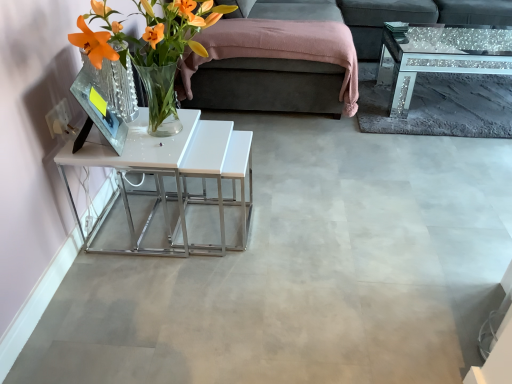
Question: Considering the relative sizes of dark gray fabric studio couch at upper center and dark gray fabric couch at upper right in the image provided, is dark gray fabric studio couch at upper center shorter than dark gray fabric couch at upper right?

Choices:
 (A) no
 (B) yes

Answer: (A)

Question: From a real-world perspective, is dark gray fabric studio couch at upper center on dark gray fabric couch at upper right?

Choices:
 (A) yes
 (B) no

Answer: (A)

Question: Is dark gray fabric studio couch at upper center closer to the viewer compared to dark gray fabric couch at upper right?

Choices:
 (A) no
 (B) yes

Answer: (B)

Question: Does dark gray fabric studio couch at upper center turn towards dark gray fabric couch at upper right?

Choices:
 (A) yes
 (B) no

Answer: (B)

Question: Is dark gray fabric studio couch at upper center not near dark gray fabric couch at upper right?

Choices:
 (A) no
 (B) yes

Answer: (A)

Question: Does dark gray fabric studio couch at upper center contain dark gray fabric couch at upper right?

Choices:
 (A) yes
 (B) no

Answer: (A)

Question: Is there a large distance between dark gray fabric couch at upper right and translucent glass vase at left?

Choices:
 (A) yes
 (B) no

Answer: (A)

Question: Is dark gray fabric couch at upper right smaller than translucent glass vase at left?

Choices:
 (A) yes
 (B) no

Answer: (B)

Question: Is dark gray fabric couch at upper right not inside translucent glass vase at left?

Choices:
 (A) no
 (B) yes

Answer: (B)

Question: Is dark gray fabric couch at upper right at the left side of translucent glass vase at left?

Choices:
 (A) no
 (B) yes

Answer: (A)

Question: From the image's perspective, is dark gray fabric couch at upper right on translucent glass vase at left?

Choices:
 (A) yes
 (B) no

Answer: (A)

Question: Is translucent glass vase at left inside dark gray fabric couch at upper right?

Choices:
 (A) yes
 (B) no

Answer: (B)

Question: Is white glossy table at left shorter than translucent glass vase at left?

Choices:
 (A) no
 (B) yes

Answer: (B)